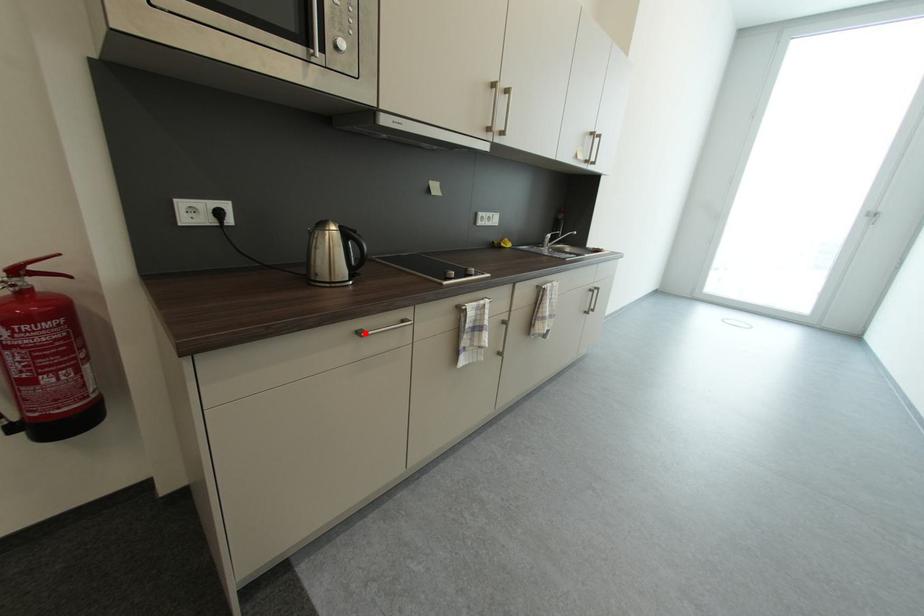
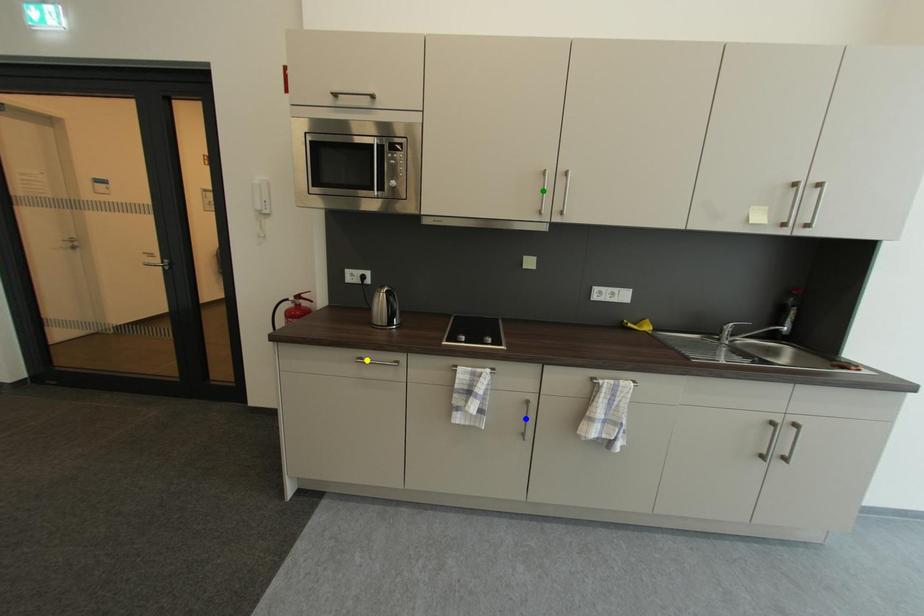
Question: I am providing you with two images of the same scene from different viewpoints. A red point is marked on the first image. You are given multiple points on the second image. In image 2, which mark is for the same physical point as the one in image 1?

Choices:
 (A) yellow point
 (B) blue point
 (C) green point

Answer: (A)